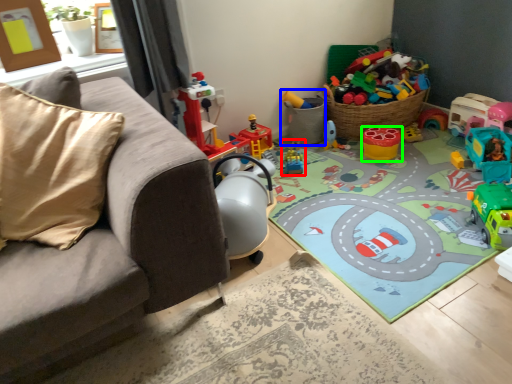
Question: Based on their relative distances, which object is nearer to toy (highlighted by a red box)? Choose from toy (highlighted by a blue box) and toy (highlighted by a green box).

Choices:
 (A) toy
 (B) toy

Answer: (A)